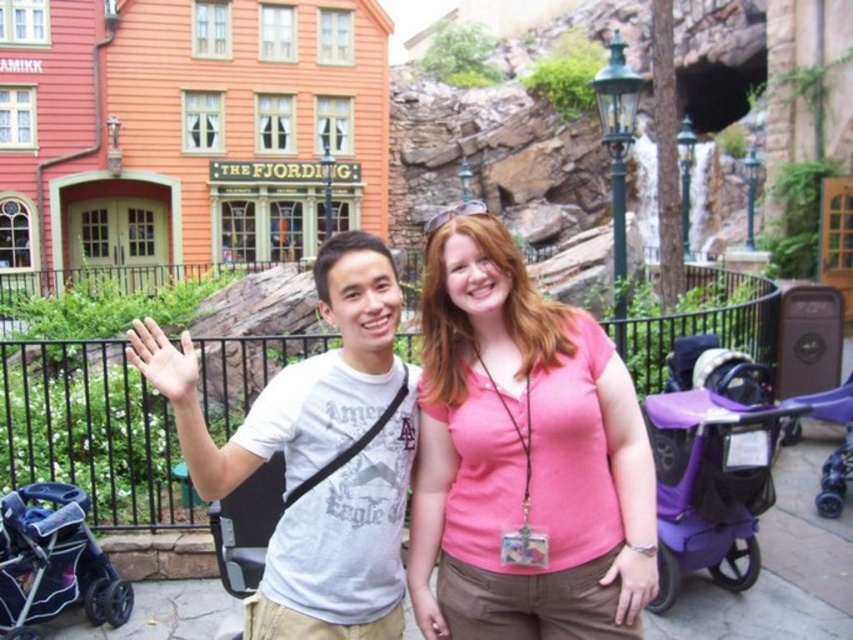
You are a photographer trying to capture both the purple matte baby carriage at lower right and the dark purple plastic stroller at lower left in a single shot. Which one should you adjust your camera focus on to ensure both are in focus?

You should focus on the dark purple plastic stroller at lower left because it is farther away from the camera than the purple matte baby carriage at lower right, ensuring both are within the depth of field.

You are standing in front of THE FJORDING building and want to place two markers at the coordinates point (647, 504) and point (685, 483). Which marker will be closer to you?

Point (647, 504) is closer to the viewer than point (685, 483).